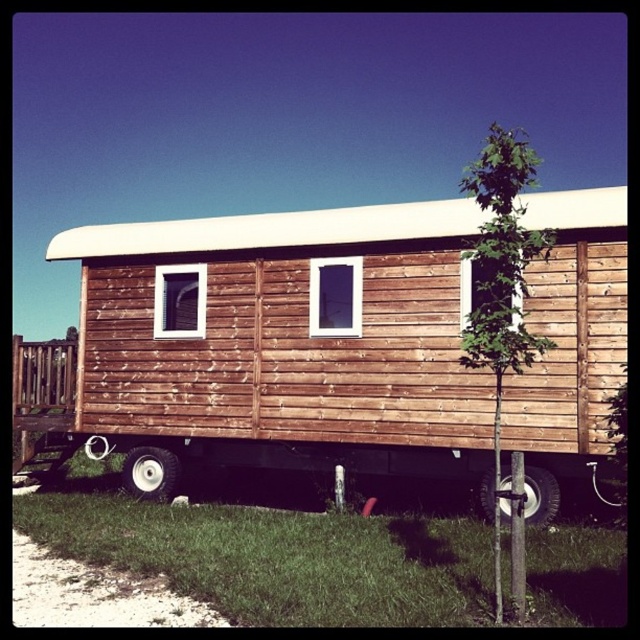
Question: Is brown wooden train car at center wider than black rubber tire at lower center?

Choices:
 (A) no
 (B) yes

Answer: (B)

Question: Considering the real-world distances, which object is farthest from the brown wooden train car at center?

Choices:
 (A) rubber/textured wheel at lower left
 (B) black rubber tire at lower center

Answer: (B)

Question: Is brown wooden train car at center positioned at the back of rubber/textured wheel at lower left?

Choices:
 (A) yes
 (B) no

Answer: (B)

Question: Which point is closer to the camera?

Choices:
 (A) black rubber tire at lower center
 (B) brown wooden train car at center
 (C) rubber/textured wheel at lower left

Answer: (B)

Question: Which point is farther to the camera?

Choices:
 (A) rubber/textured wheel at lower left
 (B) brown wooden train car at center
 (C) black rubber tire at lower center

Answer: (A)

Question: Can you confirm if black rubber tire at lower center is smaller than rubber/textured wheel at lower left?

Choices:
 (A) no
 (B) yes

Answer: (A)